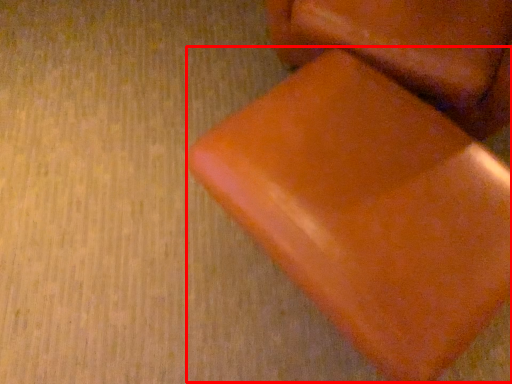
Question: From the image, what is the correct spatial relationship of bean bag chair (annotated by the red box) in relation to furniture?

Choices:
 (A) left
 (B) right

Answer: (A)